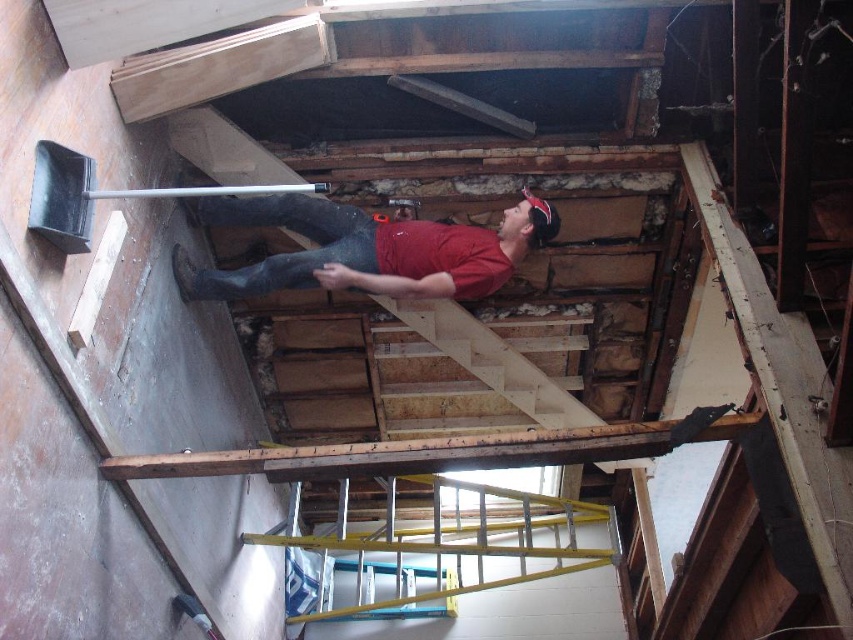
You are a safety inspector in the construction site. You see the yellow metallic ladder at center and the black plastic shovel at left. Which object is closer to the person leaning against the exposed ceiling structure?

The yellow metallic ladder at center is closer to the person leaning against the exposed ceiling structure because it is positioned to the right of the black plastic shovel at left, which is farther away.

You are standing at the origin point in the construction site. The yellow metallic ladder at center is located at coordinates 0.866, 0.509. If you need to move towards the ladder, in which direction should you head?

The yellow metallic ladder at center is located at coordinates (433, 554), so you should move towards the right and slightly forward to reach it.

Looking at this image, you are a construction worker in the building and need to reach the exposed ceiling structure. Which object, the yellow metallic ladder at center or the black plastic shovel at left, is closer to you?

The yellow metallic ladder at center is closer to you because the black plastic shovel at left is behind it.